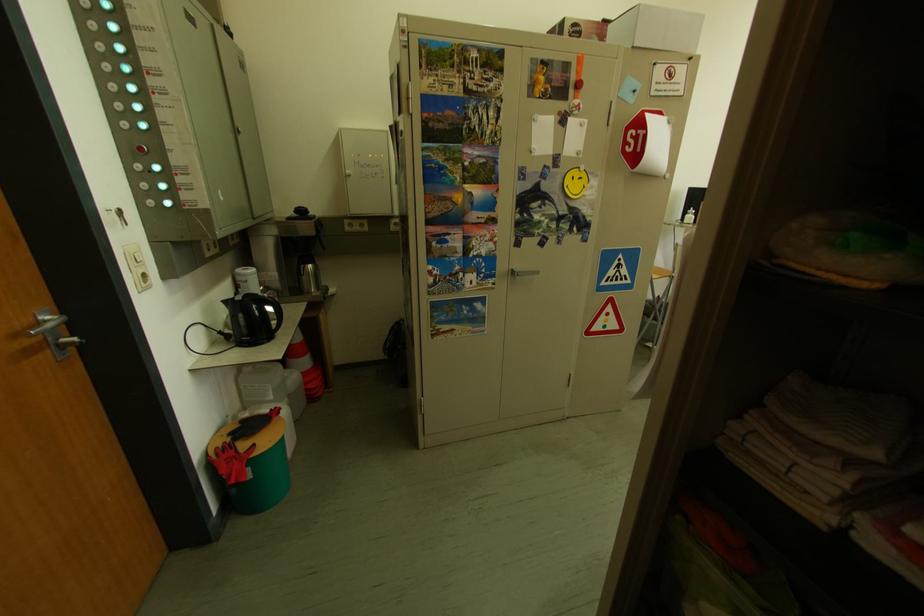
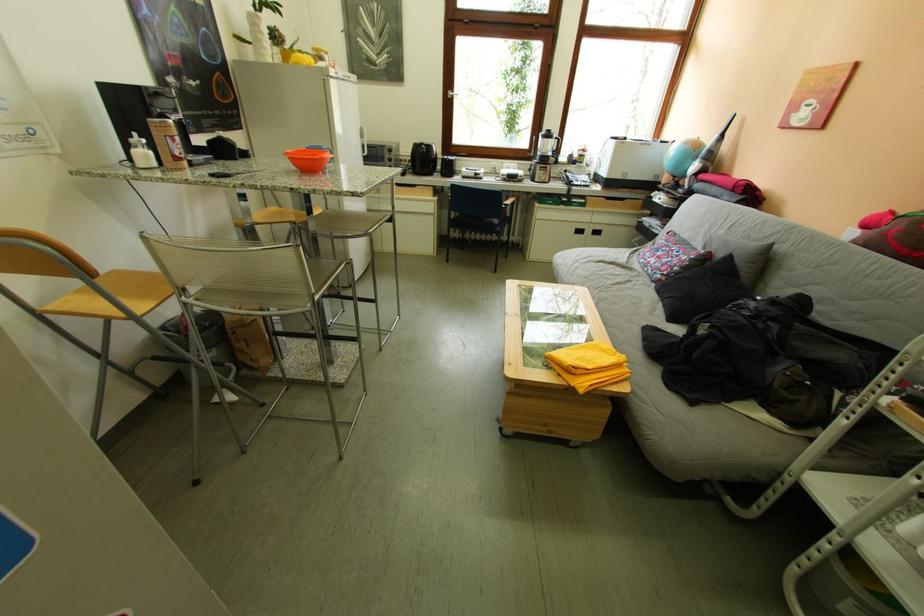
The point at (701,213) is marked in the first image. Where is the corresponding point in the second image?

(144, 140)